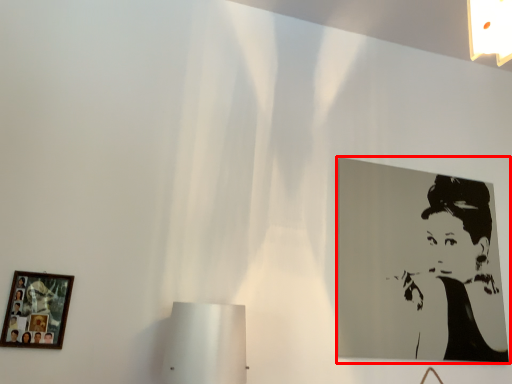
Question: From the image, what is the correct spatial relationship of picture frame (annotated by the red box) in relation to picture frame?

Choices:
 (A) right
 (B) left

Answer: (A)